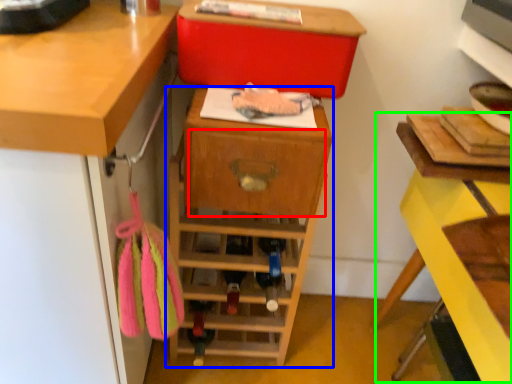
Question: Considering the real-world distances, which object is closest to drawer (highlighted by a red box)? shelf (highlighted by a blue box) or computer desk (highlighted by a green box).

Choices:
 (A) shelf
 (B) computer desk

Answer: (A)